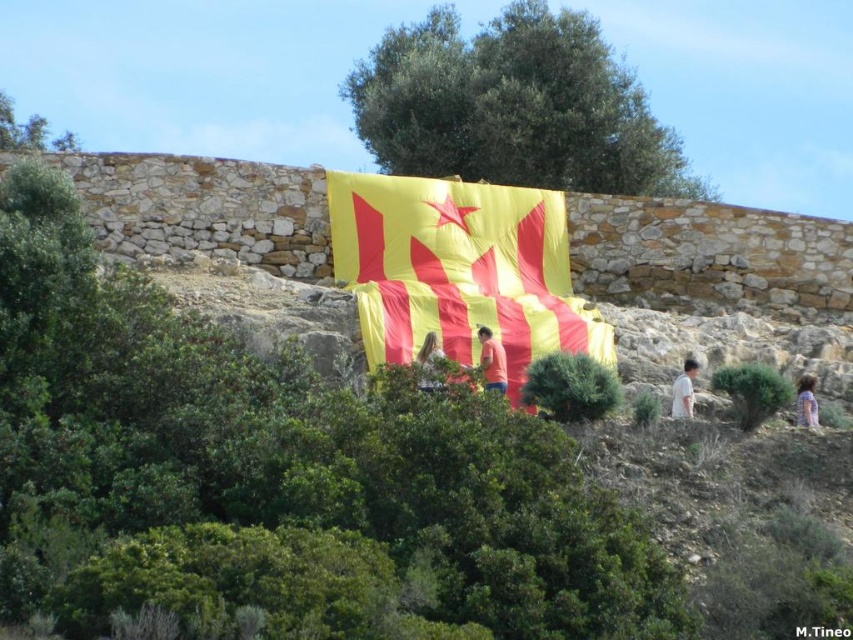
Question: From the image, what is the correct spatial relationship of light brown hair at center in relation to light brown hair at right?

Choices:
 (A) above
 (B) below

Answer: (A)

Question: Which is farther from the light brown hair at center?

Choices:
 (A) light brown hair at right
 (B) matte red shirt at center

Answer: (B)

Question: Which of the following is the closest to the observer?

Choices:
 (A) yellowmaterial/textureflag at center
 (B) light brown hair at center
 (C) matte red shirt at center

Answer: (C)

Question: Which of the following is the closest to the observer?

Choices:
 (A) light brown hair at center
 (B) matte red shirt at center

Answer: (B)

Question: Considering the relative positions of yellowmaterial/textureflag at center and light brown hair at center in the image provided, where is yellowmaterial/textureflag at center located with respect to light brown hair at center?

Choices:
 (A) left
 (B) right

Answer: (A)

Question: Is matte red shirt at center wider than light brown hair at center?

Choices:
 (A) yes
 (B) no

Answer: (A)